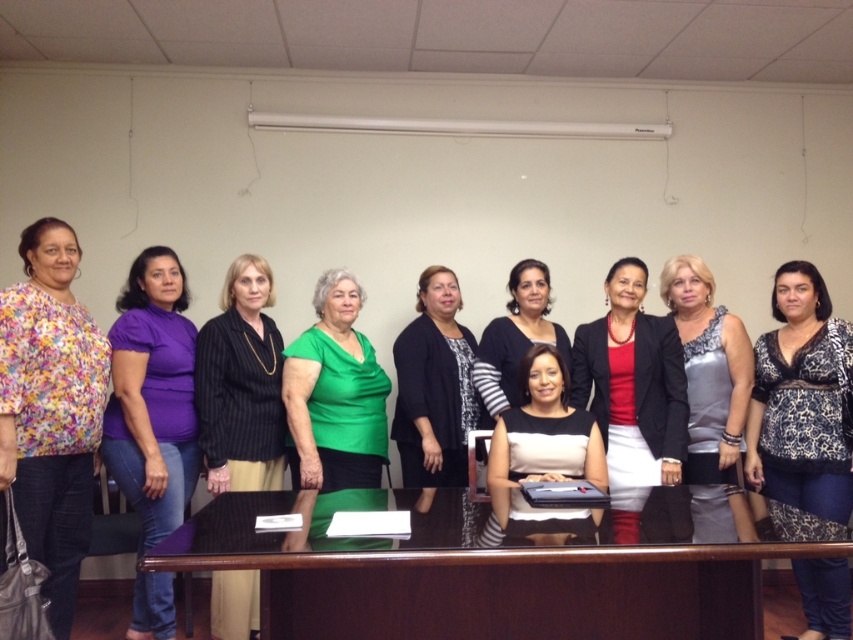
Question: Which of these objects is positioned farthest from the matte black sweater at center?

Choices:
 (A) black striped shirt at center
 (B) brown wood table at center
 (C) matte red blouse at center

Answer: (B)

Question: Is brown wood table at center above black striped shirt at center?

Choices:
 (A) no
 (B) yes

Answer: (A)

Question: Is matte red blouse at center above matte black sweater at center?

Choices:
 (A) no
 (B) yes

Answer: (A)

Question: Observing the image, what is the correct spatial positioning of black printed blouse at center in reference to matte black sweater at center?

Choices:
 (A) right
 (B) left

Answer: (A)

Question: Which of the following is the farthest from the observer?

Choices:
 (A) silver sequined dress at center
 (B) matte red blouse at center
 (C) purple matte shirt at left
 (D) brown wood table at center

Answer: (A)

Question: Which object appears farthest from the camera in this image?

Choices:
 (A) black printed blouse at center
 (B) black textured dress at center
 (C) green satin blouse at center

Answer: (B)